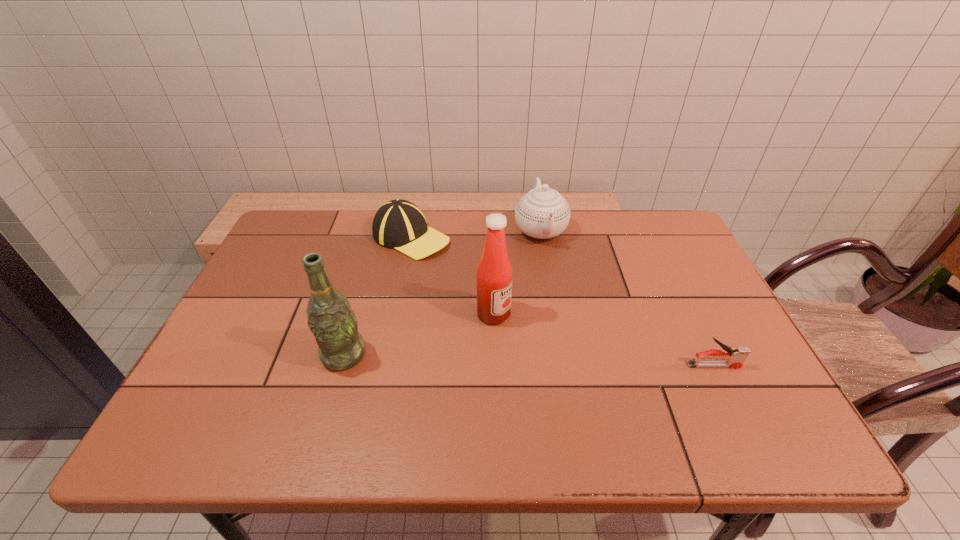
Where is `free space on the desktop that is between the beer bottle and the stapler and is positioned on the front-facing side of the condiment`? This screenshot has width=960, height=540. free space on the desktop that is between the beer bottle and the stapler and is positioned on the front-facing side of the condiment is located at coordinates tap(564, 361).

In order to click on free spot on the desktop that is between the beer bottle and the stapler and is positioned with the brim of the baseball cap facing forward in this screenshot , I will do `click(561, 361)`.

At what (x,y) coordinates should I click in order to perform the action: click on vacant spot on the desktop that is between the beer bottle and the rightmost object and is positioned on the spout of the chinaware. Please return your answer as a coordinate pair (x, y). The image size is (960, 540). Looking at the image, I should click on (582, 362).